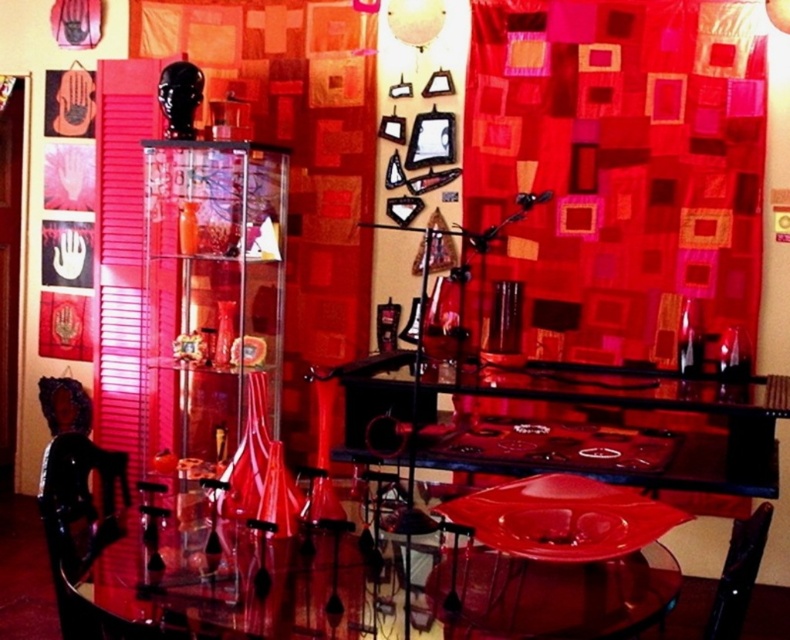
Question: Which object appears farthest from the camera in this image?

Choices:
 (A) matte red fabric at upper right
 (B) transparent glass table at center
 (C) black leather chair at lower right

Answer: (A)

Question: In this image, where is matte red fabric at upper right located relative to black leather chair at lower right?

Choices:
 (A) above
 (B) below

Answer: (A)

Question: Can you confirm if transparent glass table at center is thinner than black leather chair at lower right?

Choices:
 (A) no
 (B) yes

Answer: (A)

Question: Which of the following is the closest to the observer?

Choices:
 (A) matte red fabric at upper right
 (B) black leather chair at lower right
 (C) transparent glass table at center

Answer: (C)

Question: Which point is farther to the camera?

Choices:
 (A) transparent glass table at center
 (B) matte red fabric at upper right

Answer: (B)

Question: Does matte red fabric at upper right have a smaller size compared to black leather chair at lower right?

Choices:
 (A) no
 (B) yes

Answer: (A)